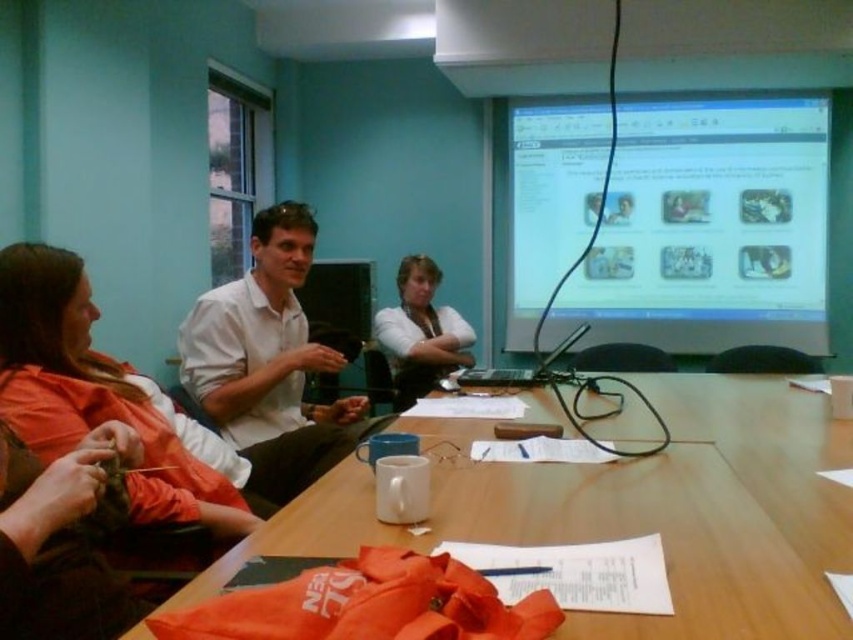
Can you confirm if matte white shirt at center is wider than black plastic laptop at center?

In fact, matte white shirt at center might be narrower than black plastic laptop at center.

Does matte white shirt at center have a larger size compared to black plastic laptop at center?

Yes.

Does point (413, 320) come in front of point (532, 381)?

No, (413, 320) is further to viewer.

Locate an element on the screen. This screenshot has width=853, height=640. matte white shirt at center is located at coordinates (421, 332).

Can you confirm if matte plastic computer screen at upper right is positioned to the right of white matte shirt at center?

Indeed, matte plastic computer screen at upper right is positioned on the right side of white matte shirt at center.

Can you confirm if matte plastic computer screen at upper right is smaller than white matte shirt at center?

Incorrect, matte plastic computer screen at upper right is not smaller in size than white matte shirt at center.

Is point (763, 323) farther from camera compared to point (236, 317)?

Yes, it is.

This screenshot has width=853, height=640. I want to click on matte plastic computer screen at upper right, so click(709, 228).

Based on the photo, can you confirm if white matte shirt at center is taller than black plastic laptop at center?

Yes, white matte shirt at center is taller than black plastic laptop at center.

Who is more distant from viewer, (300, 424) or (566, 344)?

Positioned behind is point (566, 344).

Does point (258, 301) come farther from viewer compared to point (537, 372)?

No.

The width and height of the screenshot is (853, 640). Identify the location of white matte shirt at center. (267, 362).